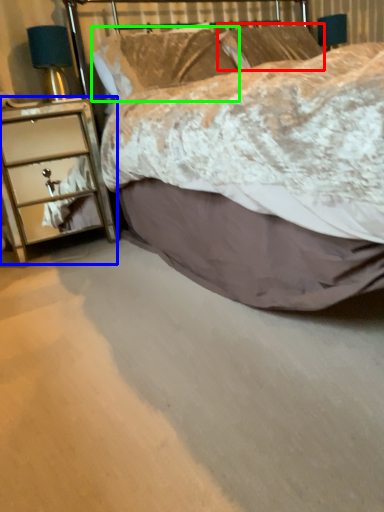
Question: Considering the real-world distances, which object is farthest from pillow (highlighted by a red box)? chest of drawers (highlighted by a blue box) or pillow (highlighted by a green box)?

Choices:
 (A) chest of drawers
 (B) pillow

Answer: (A)